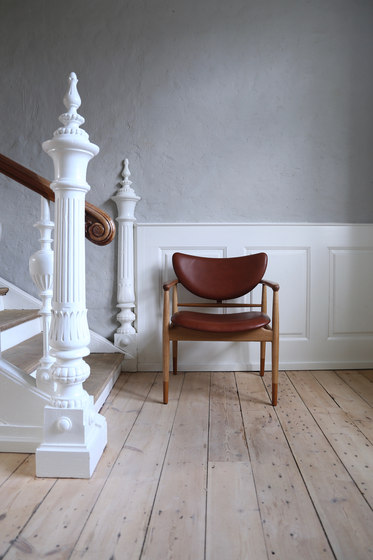
The image size is (373, 560). I want to click on second step going up, so click(x=22, y=360).